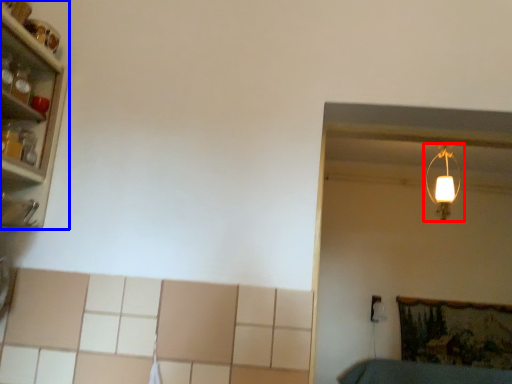
Question: Which of the following is the closest to the observer, lamp (highlighted by a red box) or shelf (highlighted by a blue box)?

Choices:
 (A) lamp
 (B) shelf

Answer: (B)